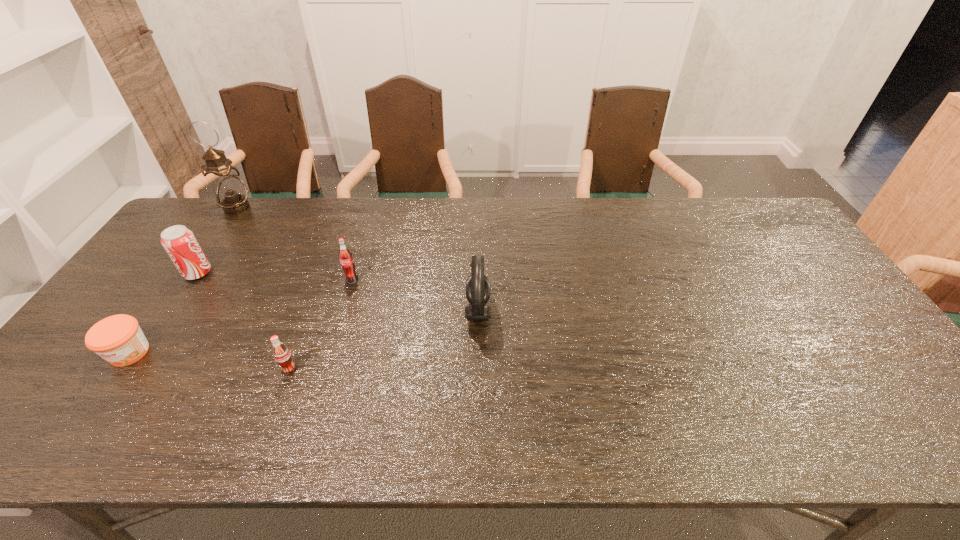
This screenshot has width=960, height=540. What are the coordinates of `free space at the far edge of the desktop` in the screenshot? It's located at (439, 240).

The width and height of the screenshot is (960, 540). Find the location of `vacant area at the left edge of the desktop`. vacant area at the left edge of the desktop is located at coordinates (213, 247).

The image size is (960, 540). I want to click on vacant space at the right edge, so click(x=871, y=342).

Image resolution: width=960 pixels, height=540 pixels. Identify the location of vacant space at the far right corner of the desktop. (753, 204).

Find the location of `free space between the fifth tallest object and the third nearest object`. free space between the fifth tallest object and the third nearest object is located at coordinates (384, 340).

Locate an element on the screen. The height and width of the screenshot is (540, 960). unoccupied area between the shortest object and the headset is located at coordinates (304, 332).

Where is `empty location between the rightmost object and the shortest object`? empty location between the rightmost object and the shortest object is located at coordinates (304, 332).

Locate an element on the screen. This screenshot has height=540, width=960. vacant region between the second object from right to left and the tallest object is located at coordinates (295, 244).

At what (x,y) coordinates should I click in order to perform the action: click on free space that is in between the leftmost soda and the rightmost object. Please return your answer as a coordinate pair (x, y). Image resolution: width=960 pixels, height=540 pixels. Looking at the image, I should click on (338, 292).

At what (x,y) coordinates should I click in order to perform the action: click on blank region between the farthest object and the rightmost soda. Please return your answer as a coordinate pair (x, y). Image resolution: width=960 pixels, height=540 pixels. Looking at the image, I should click on 295,244.